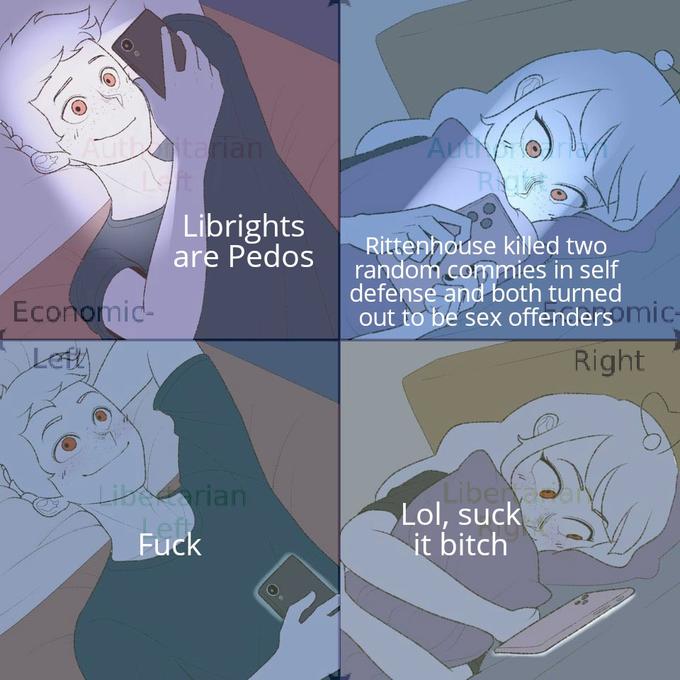
Where is `pillow`? pillow is located at coordinates (477, 485), (430, 148).